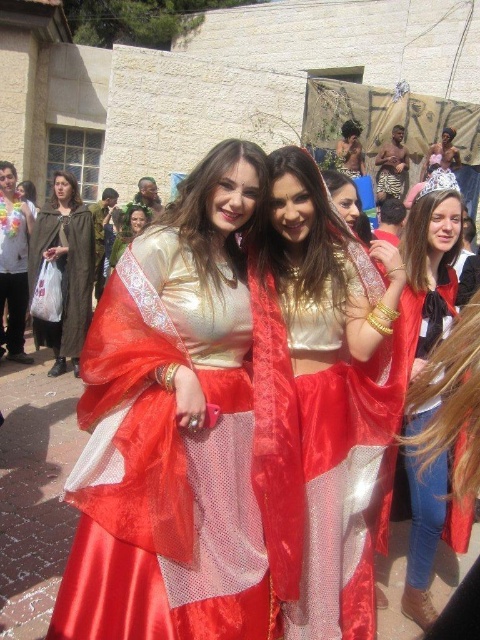
In the scene shown: Can you confirm if matte gold crown at upper right is positioned below matte gold dress at center?

Indeed, matte gold crown at upper right is positioned under matte gold dress at center.

Can you confirm if matte gold crown at upper right is positioned above matte gold dress at center?

Actually, matte gold crown at upper right is below matte gold dress at center.

I want to click on matte gold crown at upper right, so click(431, 266).

Does satin gold dress at center have a smaller size compared to silky gold robe at center?

No, satin gold dress at center is not smaller than silky gold robe at center.

Which is below, satin gold dress at center or silky gold robe at center?

satin gold dress at center is lower down.

Where is `satin gold dress at center`? Image resolution: width=480 pixels, height=640 pixels. satin gold dress at center is located at coordinates (176, 426).

Who is positioned more to the right, matte gold crown at upper right or silky gold robe at center?

matte gold crown at upper right

Which of these two, matte gold crown at upper right or silky gold robe at center, stands shorter?

silky gold robe at center

Between point (441, 472) and point (0, 355), which one is positioned behind?

The point (0, 355) is more distant.

At what (x,y) coordinates should I click in order to perform the action: click on matte gold crown at upper right. Please return your answer as a coordinate pair (x, y). Looking at the image, I should click on (431, 266).